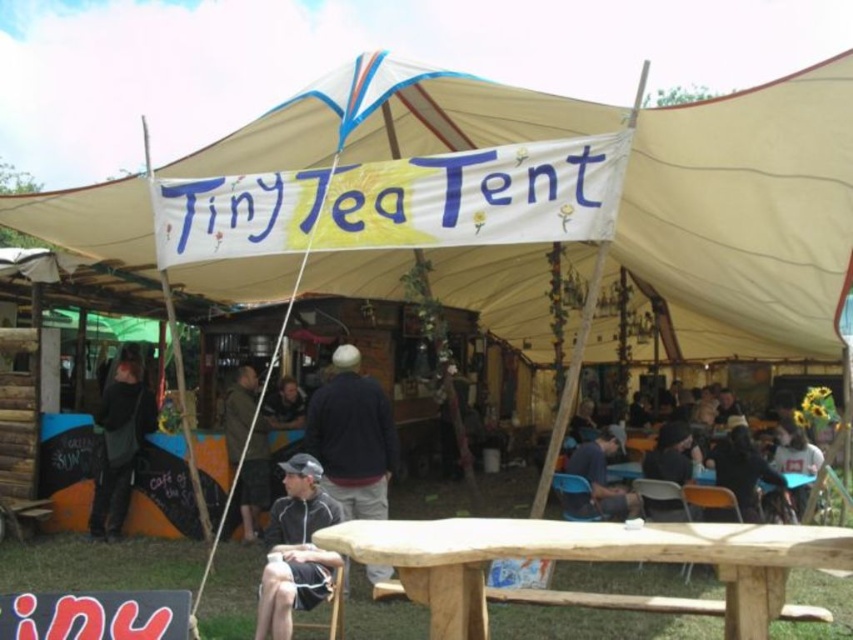
You are planning to set up a small umbrella near the beige canvas canopy at center and the black fabric jacket at lower center. Which object should you place the umbrella closer to if you want it to be proportionally smaller in the overall scene?

The umbrella should be placed closer to the black fabric jacket at lower center because the beige canvas canopy at center is larger in size, so placing the umbrella near the smaller black fabric jacket at lower center would make it appear proportionally smaller in the scene.

You are organizing a small event and need to decide which clothing item to place on a narrow shelf. Given the dark blue jacket at center and the dark blue shirt at center, which one would fit better on the shelf?

The dark blue jacket at center has a lesser width compared to the dark blue shirt at center, so the dark blue jacket at center would fit better on the narrow shelf.